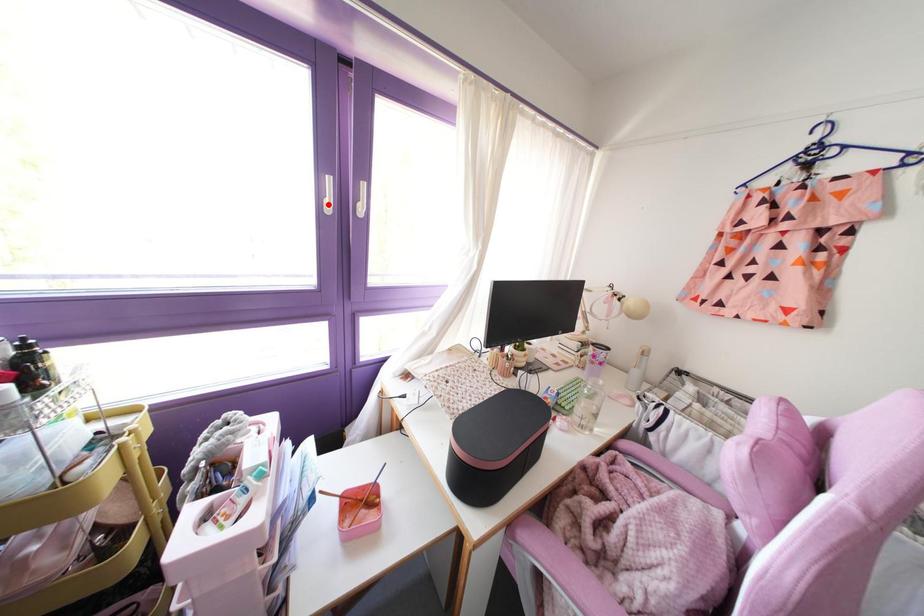
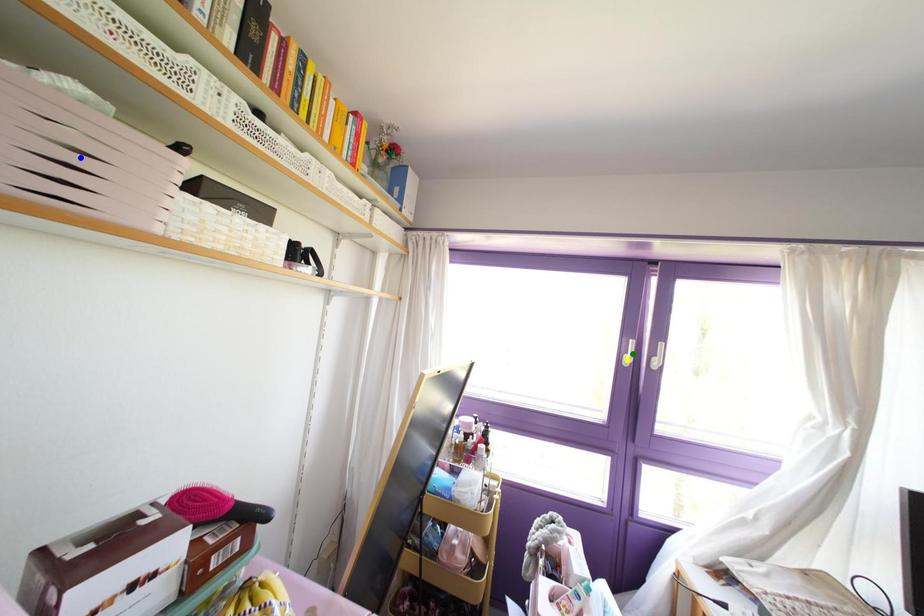
Question: I am providing you with two images of the same scene from different viewpoints. A red point is marked on the first image. You are given multiple points on the second image. In image 2, which mark is for the same physical point as the one in image 1?

Choices:
 (A) green point
 (B) blue point
 (C) yellow point

Answer: (C)